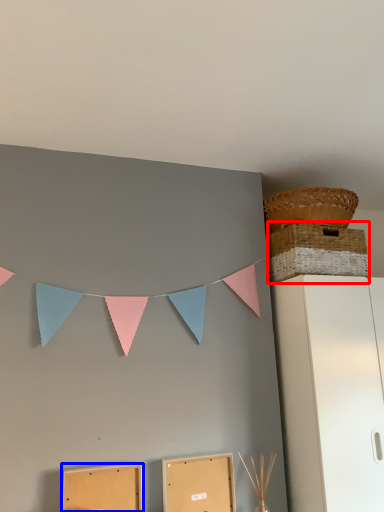
Question: Which object is closer to the camera taking this photo, basket (highlighted by a red box) or cardboard box (highlighted by a blue box)?

Choices:
 (A) basket
 (B) cardboard box

Answer: (B)